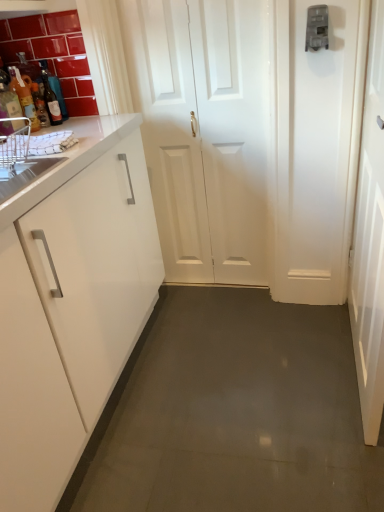
Question: Can you confirm if translucent glass bottle at left, arranged as the first bottle when viewed from the left, is shorter than white glossy sink at left?

Choices:
 (A) no
 (B) yes

Answer: (A)

Question: Is translucent glass bottle at left, arranged as the first bottle when viewed from the left, next to white glossy sink at left?

Choices:
 (A) no
 (B) yes

Answer: (A)

Question: Is white glossy sink at left located within translucent glass bottle at left, the 3th bottle from the right?

Choices:
 (A) no
 (B) yes

Answer: (A)

Question: Considering the relative sizes of translucent glass bottle at left, the 3th bottle from the right, and white glossy sink at left in the image provided, is translucent glass bottle at left, the 3th bottle from the right, thinner than white glossy sink at left?

Choices:
 (A) yes
 (B) no

Answer: (A)

Question: Is the position of translucent glass bottle at left, the 3th bottle from the right, less distant than that of white glossy sink at left?

Choices:
 (A) no
 (B) yes

Answer: (A)

Question: Does translucent glass bottle at left, the 3th bottle from the right, appear on the left side of white glossy sink at left?

Choices:
 (A) no
 (B) yes

Answer: (B)

Question: From the image's perspective, is white glossy door at center, acting as the 2th door starting from the right, beneath white glossy door at right, arranged as the first door when viewed from the right?

Choices:
 (A) no
 (B) yes

Answer: (A)

Question: Considering the relative sizes of white glossy door at center, acting as the 2th door starting from the right, and white glossy door at right, the second door from the left, in the image provided, is white glossy door at center, acting as the 2th door starting from the right, smaller than white glossy door at right, the second door from the left,?

Choices:
 (A) yes
 (B) no

Answer: (A)

Question: From a real-world perspective, is white glossy door at center, which is the 1th door in left-to-right order, positioned over white glossy door at right, the second door from the left, based on gravity?

Choices:
 (A) no
 (B) yes

Answer: (B)

Question: Is white glossy door at center, which is the 1th door in left-to-right order, oriented away from white glossy door at right, arranged as the first door when viewed from the right?

Choices:
 (A) yes
 (B) no

Answer: (B)

Question: Is the depth of white glossy door at center, acting as the 2th door starting from the right, less than that of white glossy door at right, arranged as the first door when viewed from the right?

Choices:
 (A) yes
 (B) no

Answer: (B)

Question: From a real-world perspective, is white glossy door at center, acting as the 2th door starting from the right, beneath white glossy door at right, the second door from the left?

Choices:
 (A) yes
 (B) no

Answer: (B)

Question: Would you say white glossy door at center, acting as the 2th door starting from the right, is part of white glossy door at right, the second door from the left,'s contents?

Choices:
 (A) yes
 (B) no

Answer: (B)